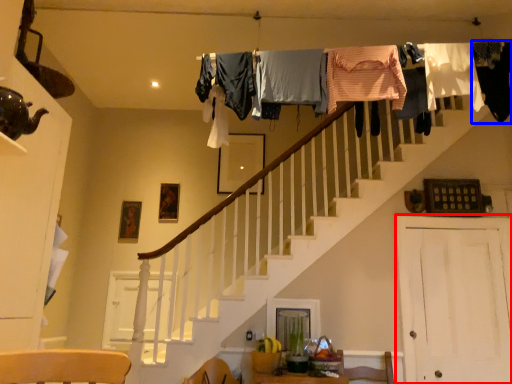
Question: Which point is closer to the camera, barn door (highlighted by a red box) or clothing (highlighted by a blue box)?

Choices:
 (A) barn door
 (B) clothing

Answer: (B)